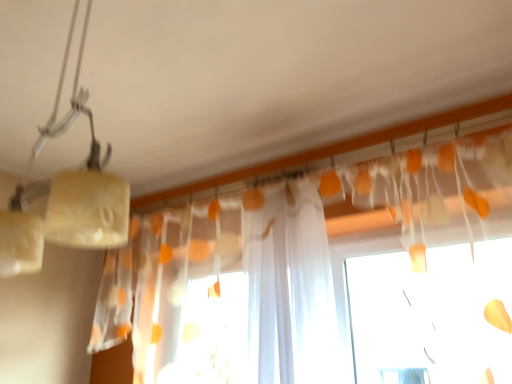
Question: Is matte white lamp at upper left spatially inside translucent white curtain at upper center, or outside of it?

Choices:
 (A) inside
 (B) outside

Answer: (B)

Question: Is matte white lamp at upper left in front of or behind translucent white curtain at upper center in the image?

Choices:
 (A) front
 (B) behind

Answer: (A)

Question: From a real-world perspective, relative to translucent white curtain at upper center, is matte white lamp at upper left vertically above or below?

Choices:
 (A) below
 (B) above

Answer: (B)

Question: Visually, is translucent white curtain at upper center positioned to the left or to the right of matte white lamp at upper left?

Choices:
 (A) left
 (B) right

Answer: (B)

Question: Does point (312, 185) appear closer or farther from the camera than point (6, 223)?

Choices:
 (A) closer
 (B) farther

Answer: (B)

Question: Is translucent white curtain at upper center bigger or smaller than matte white lamp at upper left?

Choices:
 (A) big
 (B) small

Answer: (A)

Question: Considering their positions, is translucent white curtain at upper center located in front of or behind matte white lamp at upper left?

Choices:
 (A) front
 (B) behind

Answer: (B)